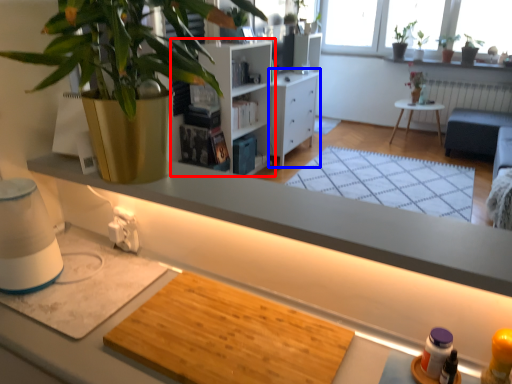
Question: Which object appears closest to the camera in this image, shelf (highlighted by a red box) or cabinetry (highlighted by a blue box)?

Choices:
 (A) shelf
 (B) cabinetry

Answer: (A)